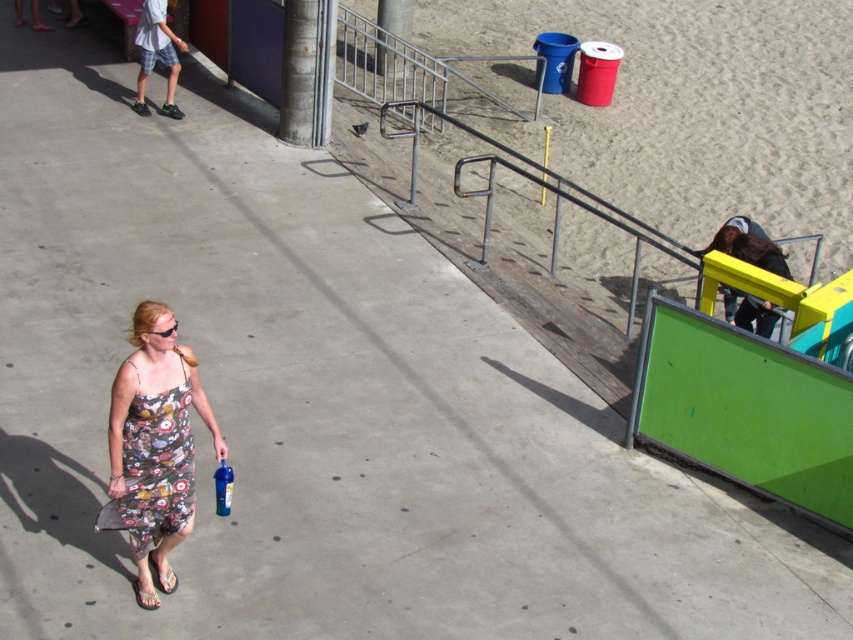
You are a photographer trying to capture a candid shot of the floral print fabric dress at lower left and the plaid shorts at upper left. Which of these two items should you zoom in on to focus on the narrower object?

The floral print fabric dress at lower left has a lesser width compared to plaid shorts at upper left, so you should zoom in on the floral print fabric dress at lower left to focus on the narrower object.